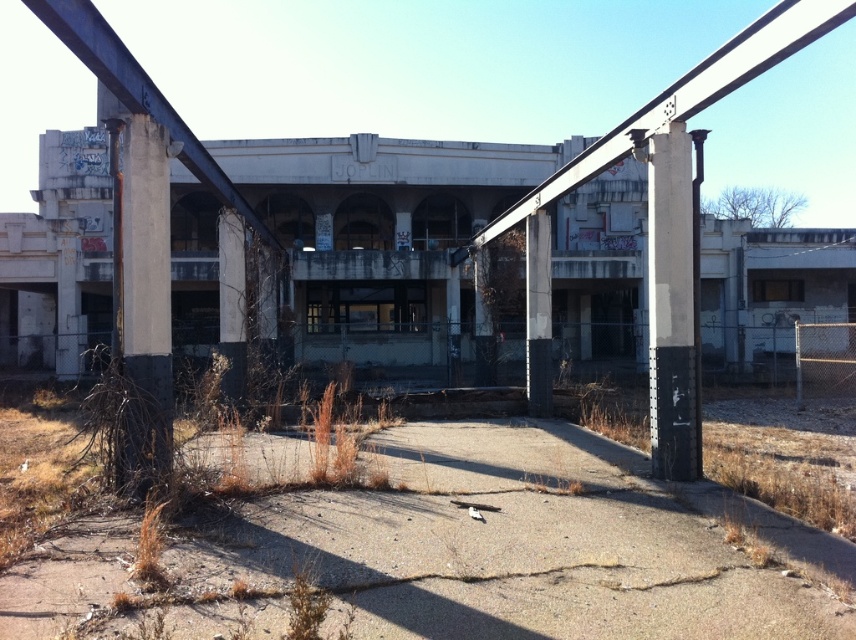
How much distance is there between concrete pillar at left and concrete pillar at center?

A distance of 8.02 meters exists between concrete pillar at left and concrete pillar at center.

Who is shorter, concrete pillar at left or concrete pillar at center?

Standing shorter between the two is concrete pillar at left.

What do you see at coordinates (146, 301) in the screenshot? This screenshot has height=640, width=856. I see `concrete pillar at left` at bounding box center [146, 301].

Identify the location of concrete pillar at left. (146, 301).

Does brown dry grass at lower left have a greater width compared to concrete at center?

Yes.

Who is more forward, (132,408) or (233,209)?

Positioned in front is point (132,408).

Is point (171, 406) more distant than point (242, 342)?

No, it is not.

Where is `brown dry grass at lower left`? The height and width of the screenshot is (640, 856). brown dry grass at lower left is located at coordinates (129, 420).

Does black concrete pillar at right have a lesser height compared to brown dry grass at lower left?

No, black concrete pillar at right is not shorter than brown dry grass at lower left.

Which is in front, point (693, 378) or point (129, 474)?

Point (129, 474) is in front.

Locate an element on the screen. The image size is (856, 640). black concrete pillar at right is located at coordinates (670, 305).